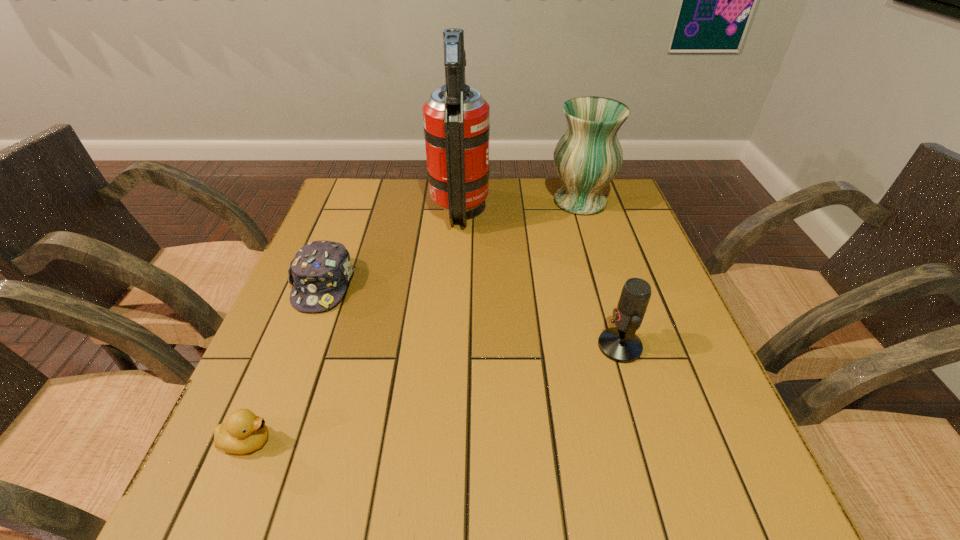
This screenshot has width=960, height=540. Find the location of `the tallest object`. the tallest object is located at coordinates (456, 118).

Image resolution: width=960 pixels, height=540 pixels. I want to click on the third object from left to right, so click(x=456, y=118).

The image size is (960, 540). I want to click on vase, so click(x=588, y=156).

Identify the location of microphone. coord(620,344).

Where is `the second nearest object`? the second nearest object is located at coordinates (620, 344).

The height and width of the screenshot is (540, 960). What are the coordinates of `the third farthest object` in the screenshot? It's located at (319, 273).

Locate an element on the screen. This screenshot has height=540, width=960. duckling is located at coordinates (244, 432).

Locate an element on the screen. The width and height of the screenshot is (960, 540). blank area located 0.150m on the front label side of the tallest object is located at coordinates (540, 208).

Find the location of a particular element. This screenshot has height=540, width=960. free spot located 0.210m on the left of the fourth shortest object is located at coordinates (479, 201).

Image resolution: width=960 pixels, height=540 pixels. In order to click on vacant position located on the side of the third tallest object with the red ring in this screenshot , I will do `click(512, 346)`.